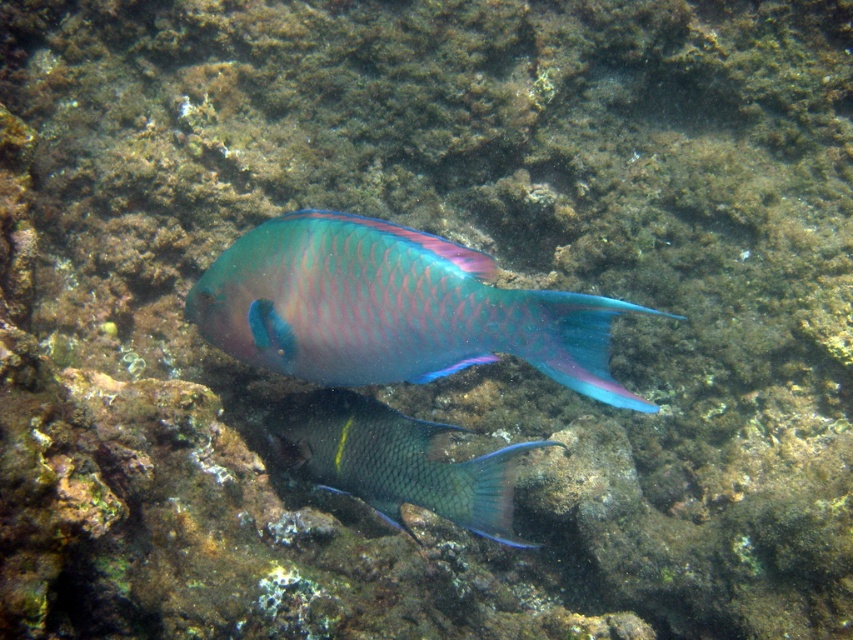
You are a marine biologist observing underwater life. You notice a metallic iridescent fish at center. If you want to take a closeup photo of it without disturbing the fish, and your camera has a minimum focus distance of 30 inches, will you be able to take the photo from your current position?

The metallic iridescent fish at center and viewer are 35.39 inches apart. Since the minimum focus distance is 30 inches, you can take the photo as you are already beyond the minimum required distance.

You are a marine biologist studying fish in an underwater environment. You have a coordinate grid system where the origin is at the bottom left corner of the image. The coordinates are given as fractions between 0 and 1. You need to locate the metallic iridescent fish at center. What are its coordinates?

The metallic iridescent fish at center is located at coordinates point (392, 308).